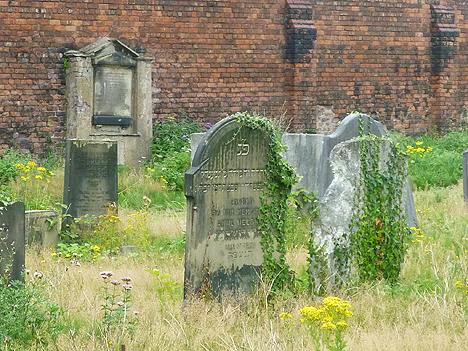
Find the location of a particular element. columns is located at coordinates (308, 94), (439, 71).